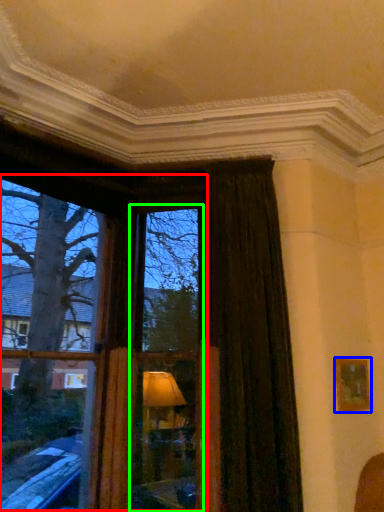
Question: Which object is positioned closest to bay window (highlighted by a red box)? Select from picture frame (highlighted by a blue box) and window frame (highlighted by a green box).

Choices:
 (A) picture frame
 (B) window frame

Answer: (B)